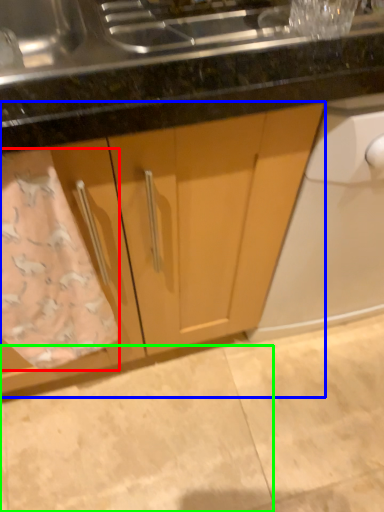
Question: Estimate the real-world distances between objects in this image. Which object is farther from bath towel (highlighted by a red box), cabinetry (highlighted by a blue box) or granite (highlighted by a green box)?

Choices:
 (A) cabinetry
 (B) granite

Answer: (B)